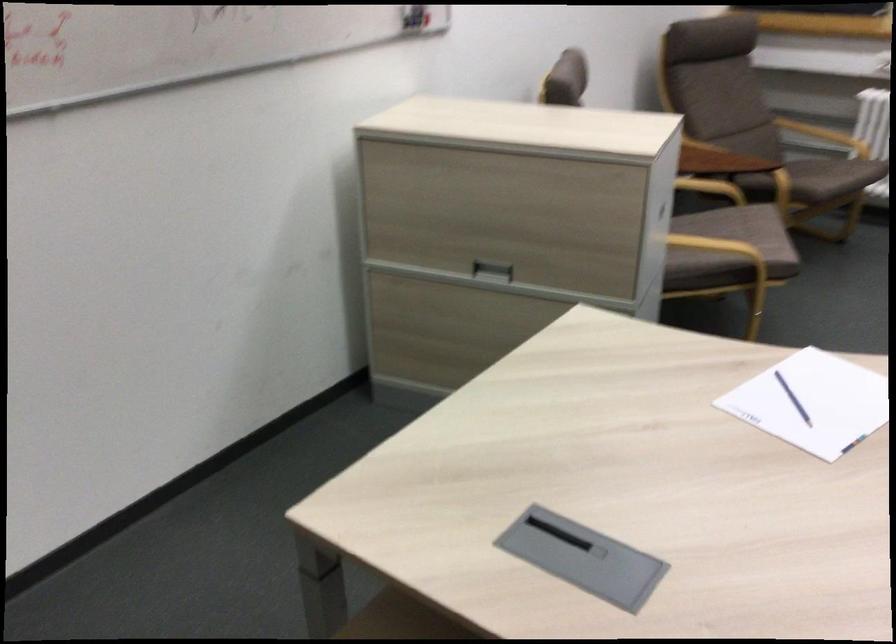
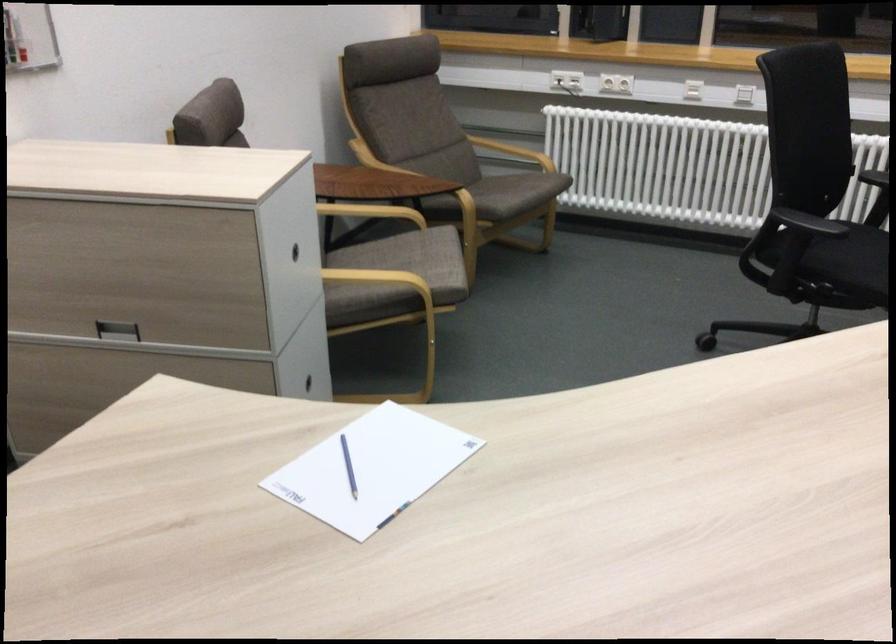
Find the pixel in the second image that matches point 785,402 in the first image.

(348, 466)